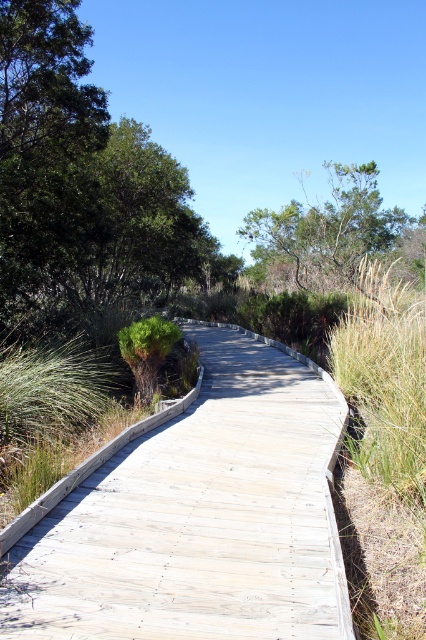
Can you confirm if light gray wooden boardwalk at center is taller than green leafy tree at upper left?

Incorrect, light gray wooden boardwalk at center's height is not larger of green leafy tree at upper left's.

Is light gray wooden boardwalk at center below green leafy tree at upper left?

Correct, light gray wooden boardwalk at center is located below green leafy tree at upper left.

Image resolution: width=426 pixels, height=640 pixels. I want to click on light gray wooden boardwalk at center, so click(199, 516).

Which is in front, point (11, 340) or point (373, 163)?

Point (11, 340) is more forward.

Is green leafy tree at upper left positioned at the back of green leafy tree at upper center?

That is False.

This screenshot has width=426, height=640. Describe the element at coordinates (83, 193) in the screenshot. I see `green leafy tree at upper left` at that location.

I want to click on green leafy tree at upper left, so click(83, 193).

Who is higher up, light gray wooden boardwalk at center or green leafy tree at upper center?

green leafy tree at upper center is higher up.

Which is more to the right, light gray wooden boardwalk at center or green leafy tree at upper center?

From the viewer's perspective, green leafy tree at upper center appears more on the right side.

Does point (328, 564) come closer to viewer compared to point (356, 250)?

Yes, it is in front of point (356, 250).

Locate an element on the screen. The width and height of the screenshot is (426, 640). light gray wooden boardwalk at center is located at coordinates [199, 516].